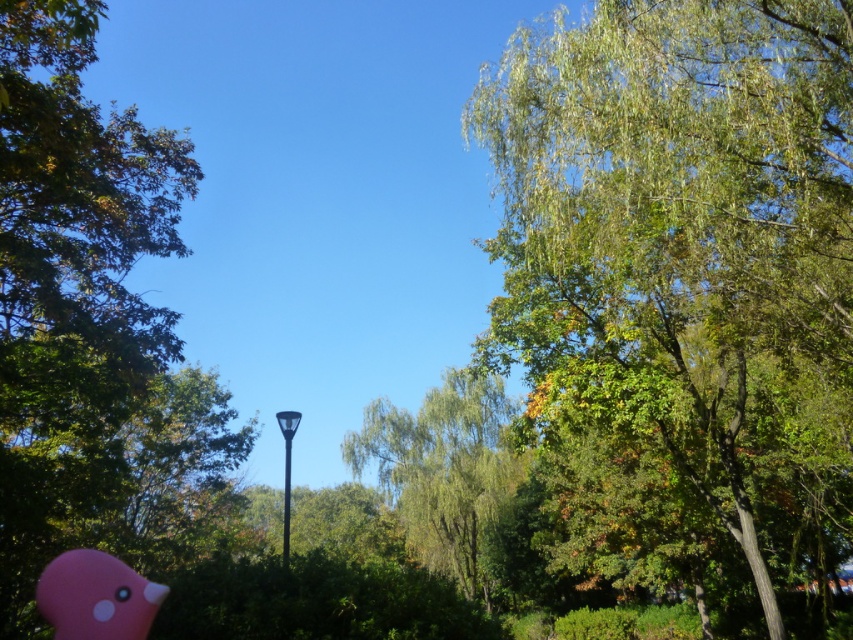
Question: Is the position of green leafy tree at upper right less distant than that of green leafy tree at left?

Choices:
 (A) yes
 (B) no

Answer: (B)

Question: Can you confirm if green leafy tree at upper right is smaller than green leafy tree at center?

Choices:
 (A) no
 (B) yes

Answer: (A)

Question: Which point is farther from the camera taking this photo?

Choices:
 (A) (26, 477)
 (B) (288, 518)
 (C) (386, 445)

Answer: (C)

Question: Can you confirm if green leafy tree at center is bigger than pink matte toy at lower left?

Choices:
 (A) yes
 (B) no

Answer: (A)

Question: Which of the following is the closest to the observer?

Choices:
 (A) pink matte toy at lower left
 (B) green leafy tree at upper right
 (C) green leafy tree at left
 (D) green leafy tree at center

Answer: (C)

Question: Which point is closer to the camera taking this photo?

Choices:
 (A) (497, 417)
 (B) (807, 132)

Answer: (B)